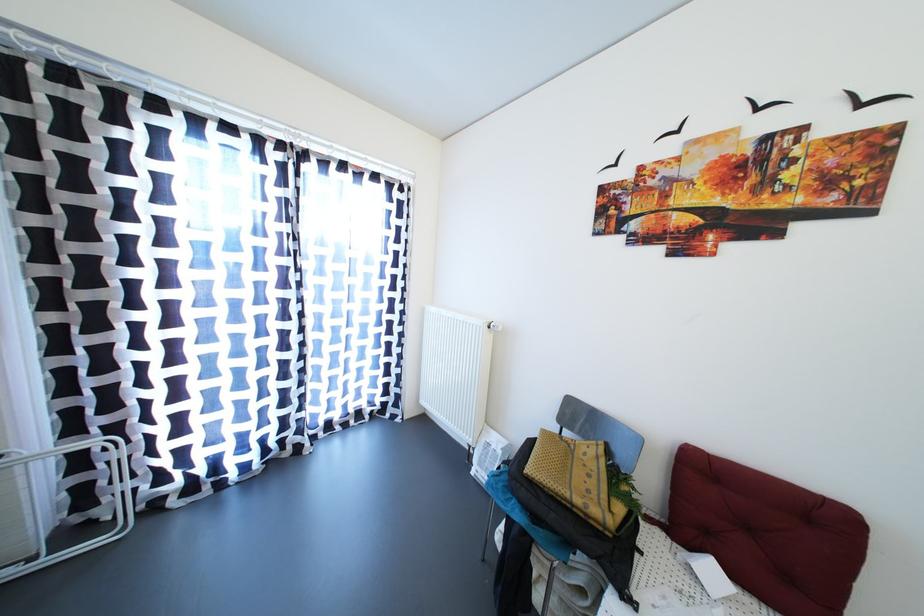
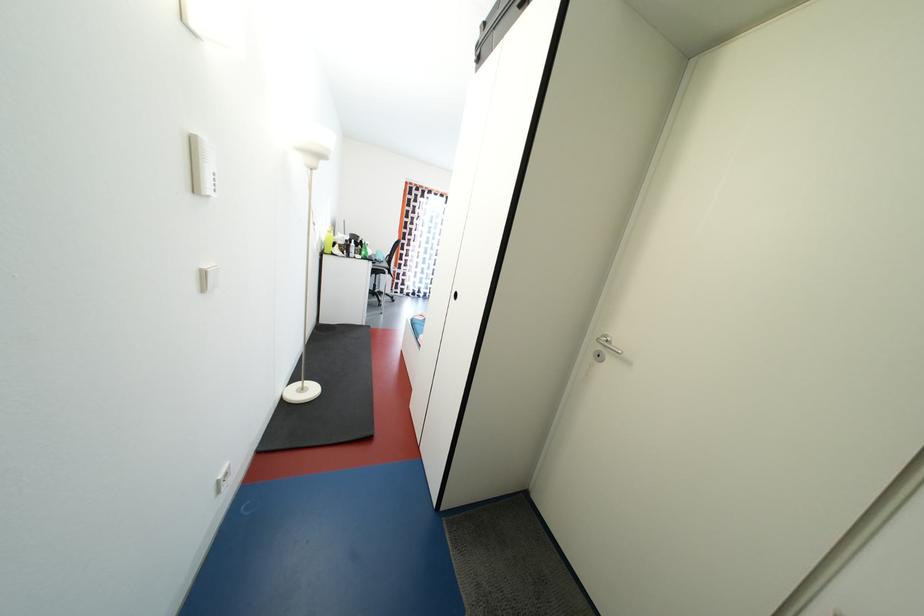
Question: What movement of the cameraman would produce the second image?

Choices:
 (A) Left
 (B) Right
 (C) Forward
 (D) Backward

Answer: (D)